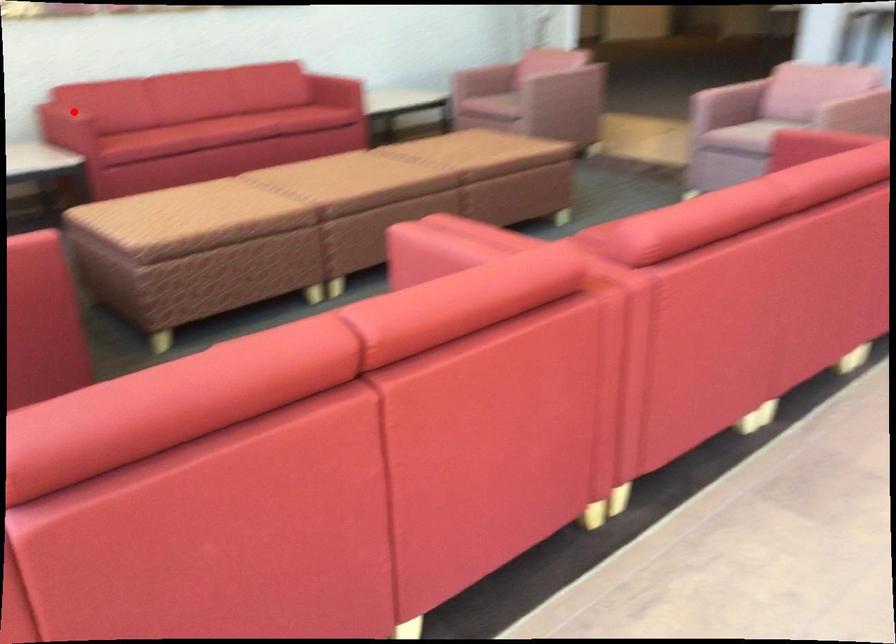
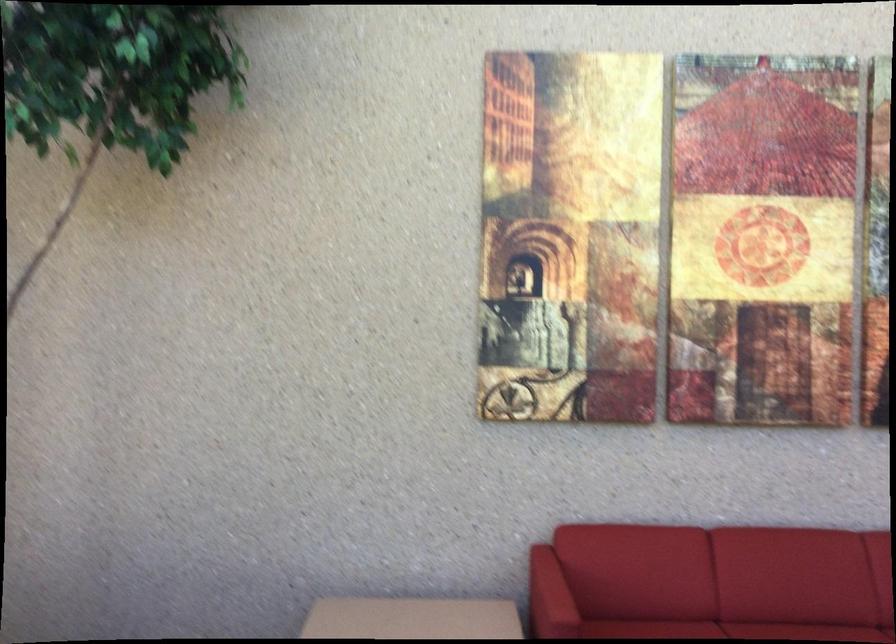
Question: A red point is marked in image1. In image2, is the corresponding 3D point closer to the camera or farther? Reply with the corresponding letter.

Choices:
 (A) The corresponding 3D point is closer.
 (B) The corresponding 3D point is farther.

Answer: (A)